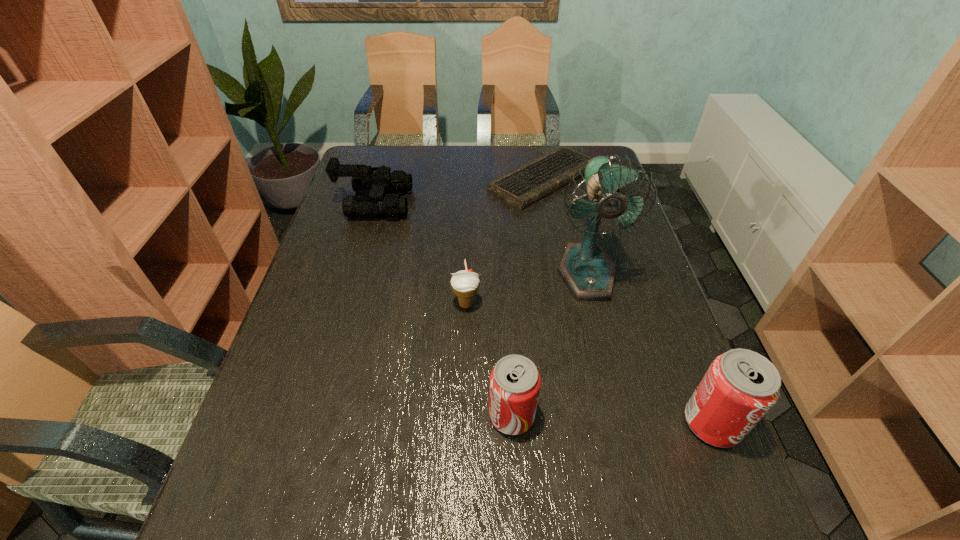
Image resolution: width=960 pixels, height=540 pixels. I want to click on object that is positioned at the near right corner, so click(x=740, y=386).

This screenshot has width=960, height=540. I want to click on free location at the far edge of the desktop, so click(x=510, y=151).

The width and height of the screenshot is (960, 540). I want to click on free space at the left edge, so click(304, 320).

You are a GUI agent. You are given a task and a screenshot of the screen. Output one action in this format:
    pyautogui.click(x=<x>, y=<y>)
    Task: Click on the vacant space at the right edge of the desktop
    Image resolution: width=960 pixels, height=540 pixels.
    Given the screenshot: What is the action you would take?
    pyautogui.click(x=634, y=375)

Locate an element on the screen. The height and width of the screenshot is (540, 960). free region at the near left corner of the desktop is located at coordinates (289, 470).

Image resolution: width=960 pixels, height=540 pixels. What are the coordinates of `free space between the rightmost object and the fifth object from right to left` in the screenshot? It's located at (589, 363).

The image size is (960, 540). Identify the location of free space between the shorter soda can and the fifth shortest object. (612, 419).

I want to click on free space between the right soda can and the tallest object, so click(650, 348).

The height and width of the screenshot is (540, 960). What are the coordinates of `free space between the binoculars and the shorter soda can` in the screenshot? It's located at point(443,309).

Locate an element on the screen. Image resolution: width=960 pixels, height=540 pixels. unoccupied position between the icecream and the leftmost object is located at coordinates (420, 254).